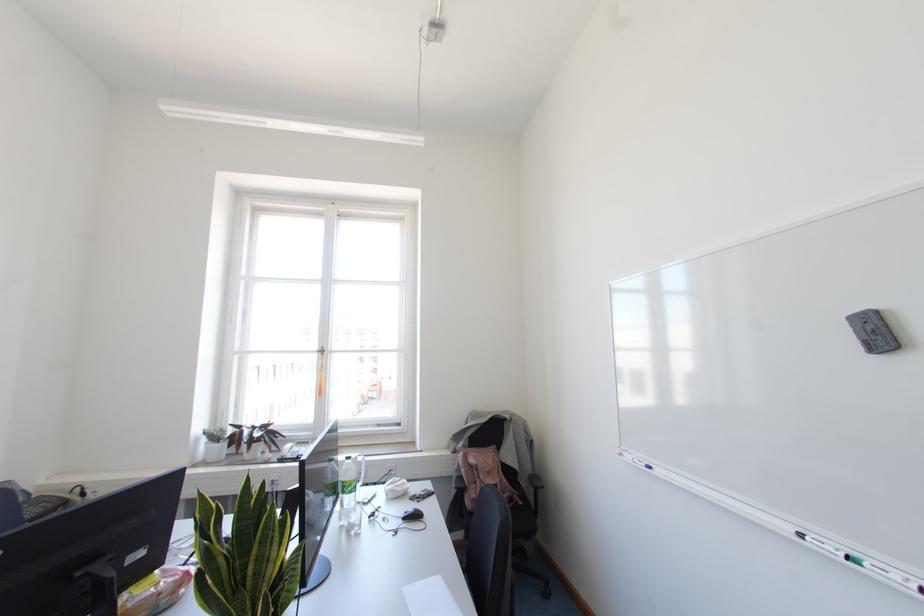
This screenshot has height=616, width=924. I want to click on white window handle, so click(x=321, y=373).